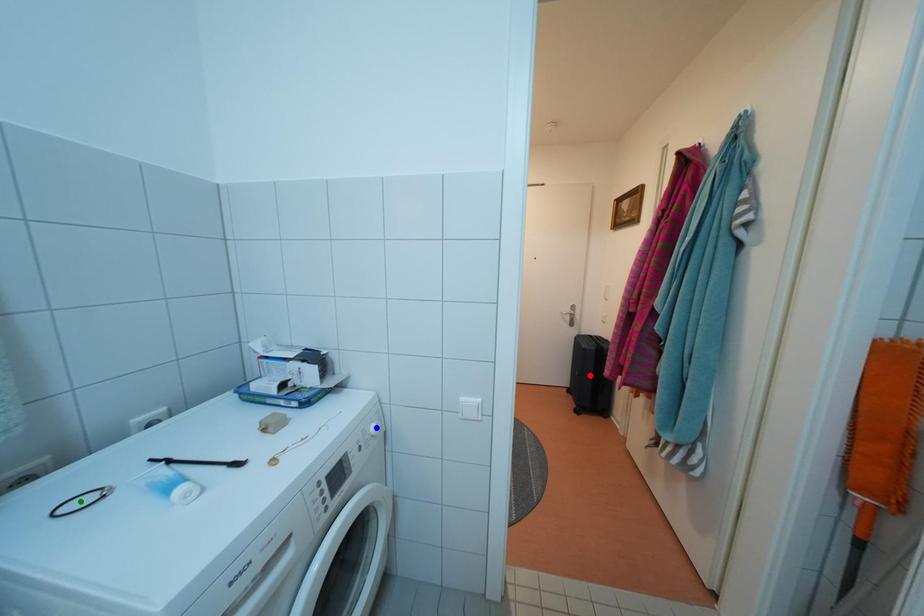
Order these from nearest to farthest:
green point
blue point
red point

green point → blue point → red point